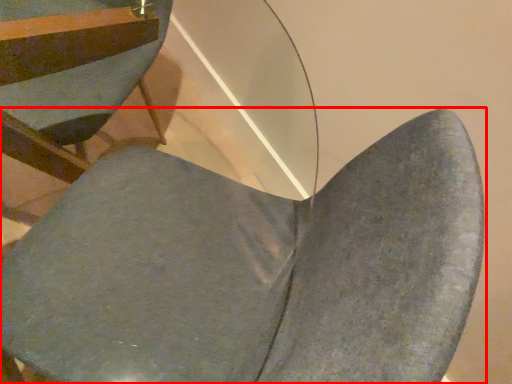
Question: Considering the relative positions of chair (annotated by the red box) and chair in the image provided, where is chair (annotated by the red box) located with respect to the staircase?

Choices:
 (A) right
 (B) left

Answer: (A)